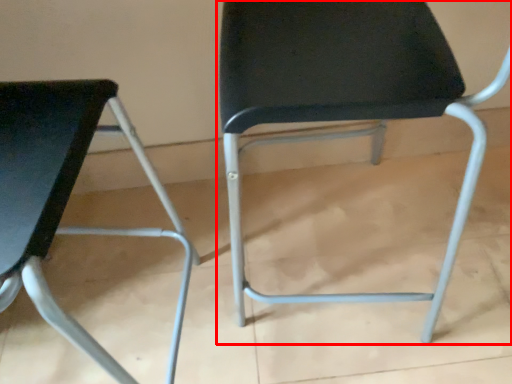
Question: Observing the image, what is the correct spatial positioning of chair (annotated by the red box) in reference to chair?

Choices:
 (A) left
 (B) right

Answer: (B)